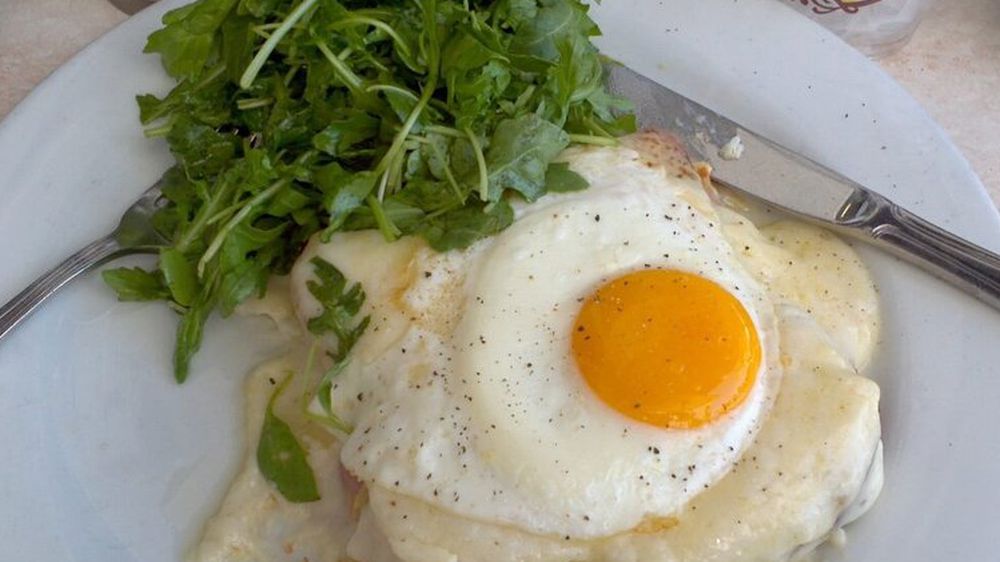
Find the location of a particular element. The image size is (1000, 562). slight view of glass cup is located at coordinates (879, 16).